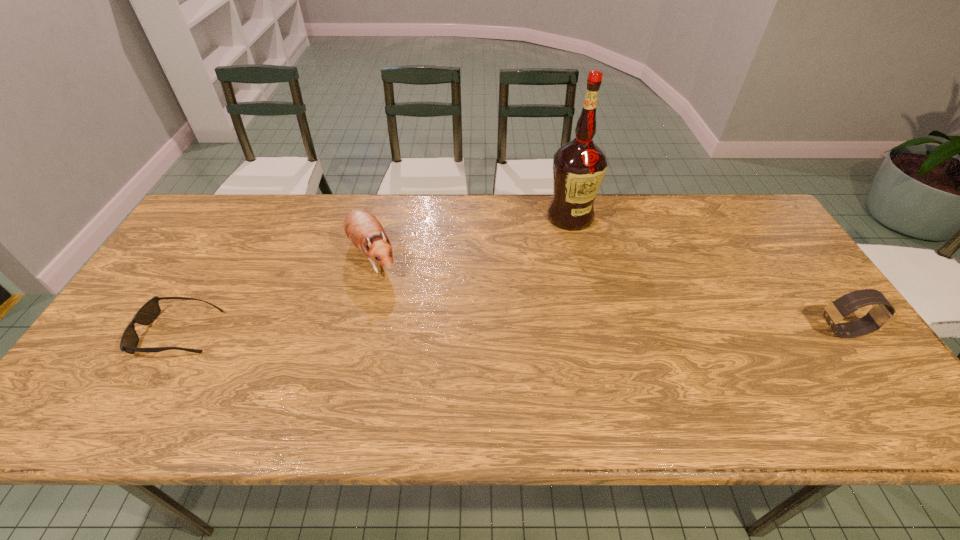
Locate an element on the screen. This screenshot has height=540, width=960. vacant space at the left edge is located at coordinates (178, 265).

Image resolution: width=960 pixels, height=540 pixels. In order to click on vacant space at the right edge in this screenshot , I will do point(800,321).

The width and height of the screenshot is (960, 540). In order to click on blank space at the far right corner of the desktop in this screenshot , I will do `click(719, 202)`.

Where is `vacant space at the near right corner`? vacant space at the near right corner is located at coordinates (836, 358).

Where is `vacant point located between the hamster and the third object from left to right`? The height and width of the screenshot is (540, 960). vacant point located between the hamster and the third object from left to right is located at coordinates (471, 236).

Locate an element on the screen. This screenshot has height=540, width=960. vacant space in between the second object from right to left and the sunglasses is located at coordinates (374, 275).

Where is `vacant space in between the hamster and the tallest object`? vacant space in between the hamster and the tallest object is located at coordinates (471, 236).

The image size is (960, 540). Find the location of `vacant area between the third object from right to left and the alcohol`. vacant area between the third object from right to left and the alcohol is located at coordinates (471, 236).

The image size is (960, 540). Find the location of `unoccupied position between the alcohol and the second object from left to right`. unoccupied position between the alcohol and the second object from left to right is located at coordinates (471, 236).

I want to click on free space between the third object from left to right and the watch, so click(x=707, y=274).